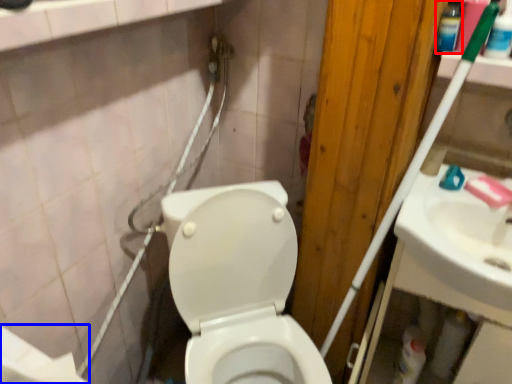
Question: Which object is further to the camera taking this photo, mouthwash (highlighted by a red box) or toilet paper (highlighted by a blue box)?

Choices:
 (A) mouthwash
 (B) toilet paper

Answer: (A)